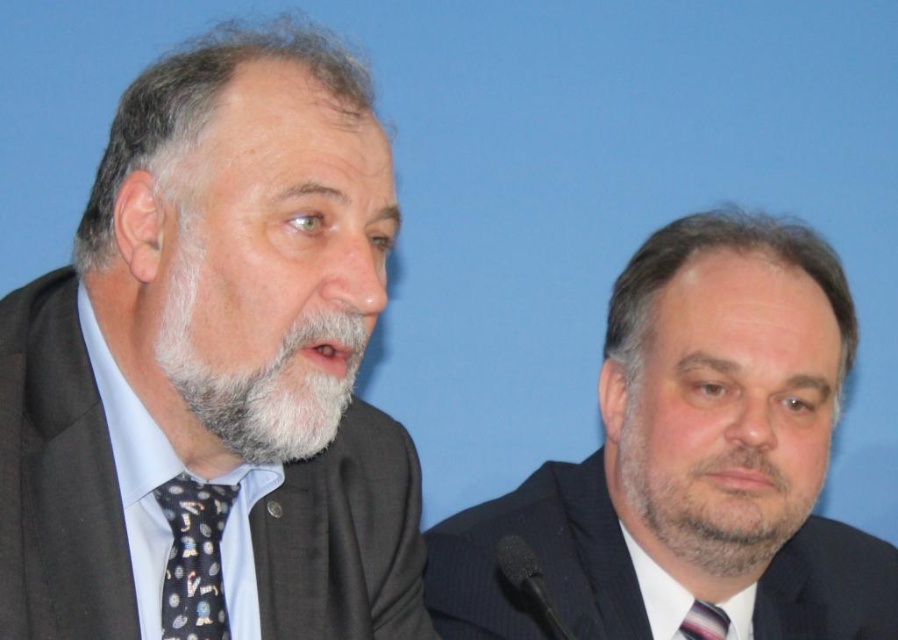
Between matte black suit at left and striped fabric tie at center, which one appears on the right side from the viewer's perspective?

Positioned to the right is striped fabric tie at center.

Between matte black suit at left and striped fabric tie at center, which one appears on the left side from the viewer's perspective?

From the viewer's perspective, matte black suit at left appears more on the left side.

What do you see at coordinates (214, 371) in the screenshot? This screenshot has height=640, width=898. I see `matte black suit at left` at bounding box center [214, 371].

In order to click on matte black suit at left in this screenshot , I will do click(214, 371).

Between black matte microphone at center and striped fabric tie at center, which one is positioned lower?

striped fabric tie at center is below.

Is black matte microphone at center to the right of striped fabric tie at center from the viewer's perspective?

In fact, black matte microphone at center is to the left of striped fabric tie at center.

Where is `black matte microphone at center`? The image size is (898, 640). black matte microphone at center is located at coordinates (529, 586).

The height and width of the screenshot is (640, 898). I want to click on black matte microphone at center, so click(529, 586).

Which is more to the left, matte black suit at left or black matte microphone at center?

Positioned to the left is matte black suit at left.

Between matte black suit at left and black matte microphone at center, which one is positioned higher?

Positioned higher is matte black suit at left.

Which is in front, point (388, 444) or point (540, 621)?

Point (388, 444) is more forward.

Find the location of a particular element. This screenshot has width=898, height=640. matte black suit at left is located at coordinates tap(214, 371).